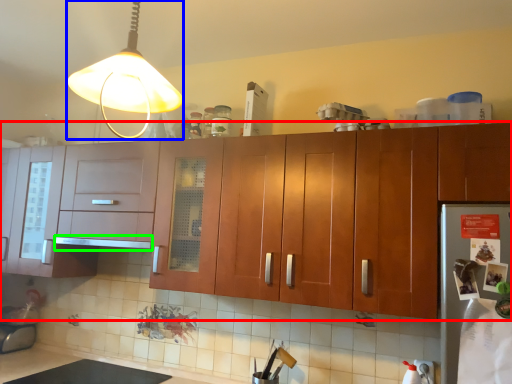
Question: Which object is the closest to the cabinetry (highlighted by a red box)? Choose among these: lamp (highlighted by a blue box) or exhaust hood (highlighted by a green box).

Choices:
 (A) lamp
 (B) exhaust hood

Answer: (B)